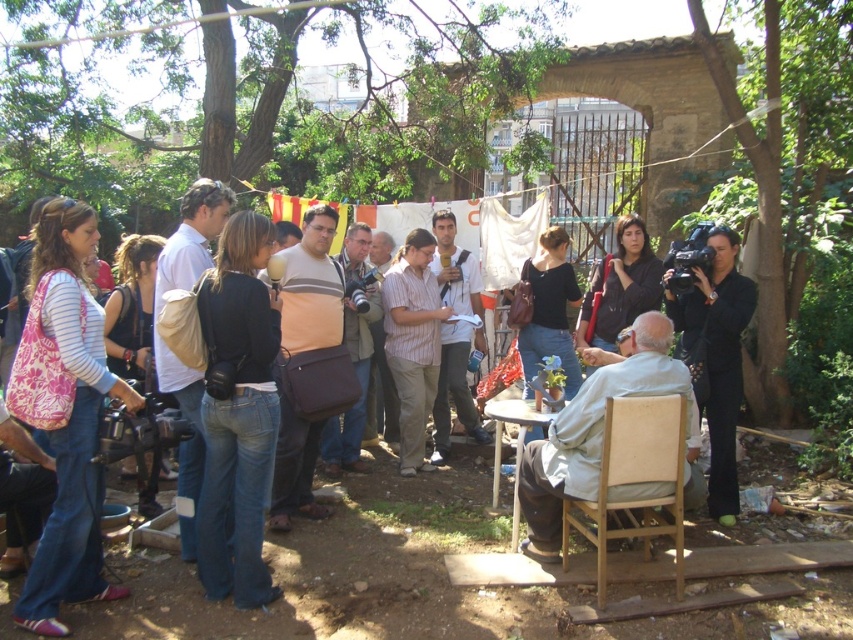
Which of these two, matte black camera at center or black suit at right, stands shorter?

Standing shorter between the two is matte black camera at center.

This screenshot has height=640, width=853. Describe the element at coordinates (340, 572) in the screenshot. I see `matte black camera at center` at that location.

Is point (532, 611) less distant than point (724, 404)?

Yes, point (532, 611) is closer to viewer.

You are a GUI agent. You are given a task and a screenshot of the screen. Output one action in this format:
    pyautogui.click(x=<x>, y=<y>)
    Task: Click on the matte black camera at center
    The height and width of the screenshot is (640, 853).
    Given the screenshot: What is the action you would take?
    pyautogui.click(x=340, y=572)

The image size is (853, 640). Describe the element at coordinates (340, 572) in the screenshot. I see `matte black camera at center` at that location.

Who is lower down, matte black camera at center or light blue fabric at center?

matte black camera at center is below.

Does point (485, 472) come behind point (531, 554)?

Yes.

I want to click on matte black camera at center, so click(340, 572).

Which is below, light blue fabric at center or black suit at right?

light blue fabric at center

Between light blue fabric at center and black suit at right, which one has less height?

light blue fabric at center is shorter.

Does point (653, 356) lie in front of point (727, 465)?

Yes, point (653, 356) is in front of point (727, 465).

Find the location of a particular element. light blue fabric at center is located at coordinates (596, 429).